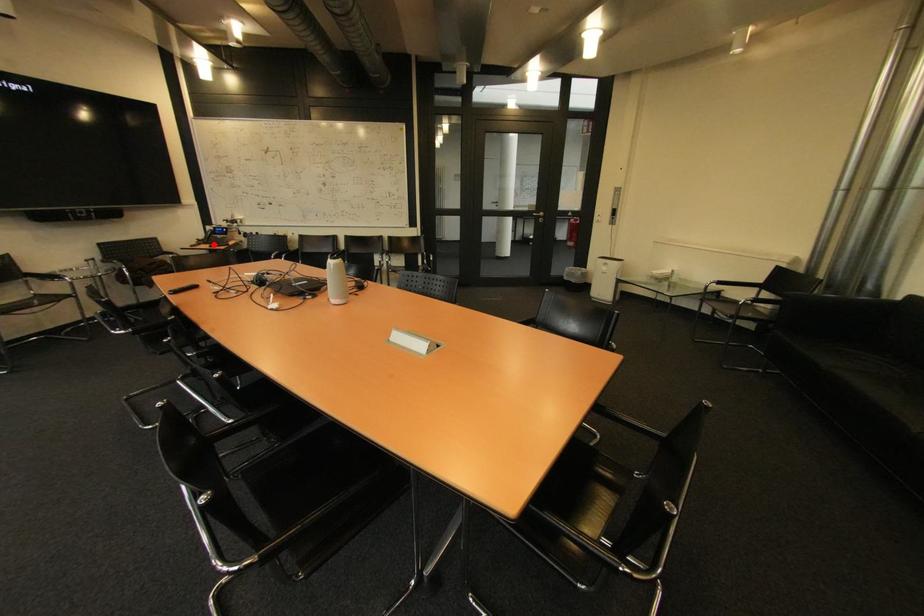
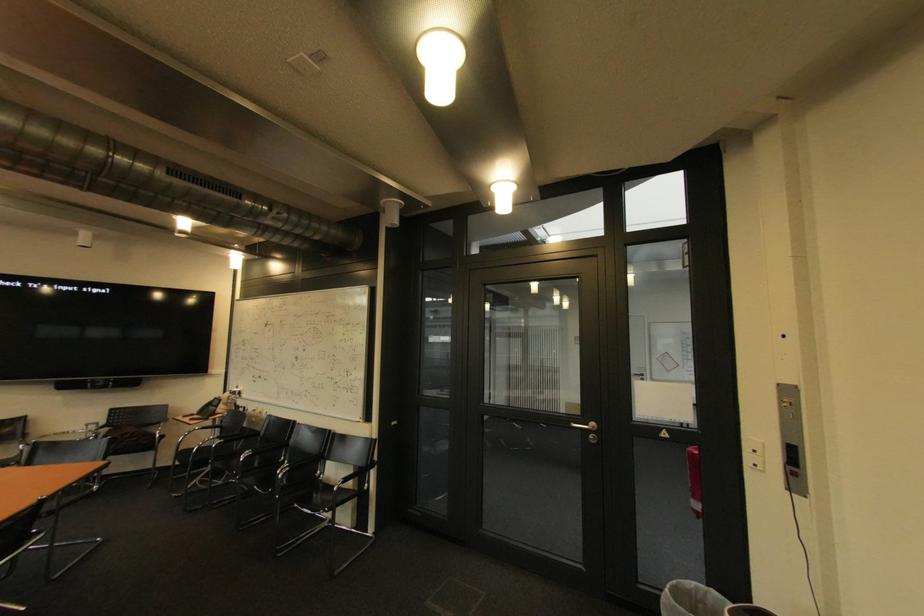
In the second image, find the point that corresponds to the highlighted location in the first image.

(204, 416)